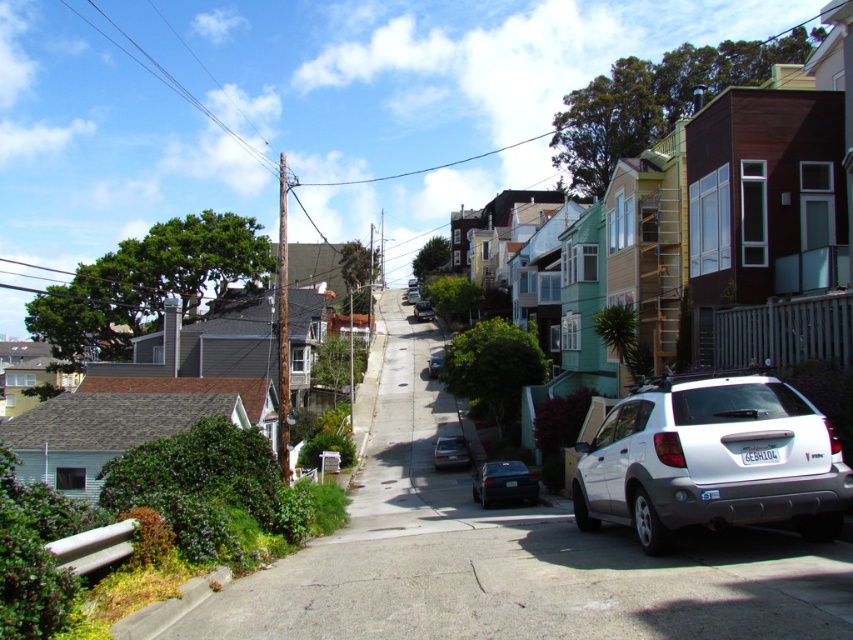
Can you confirm if matte black sedan at center is smaller than metallic silver sedan at center?

No.

Between point (445, 440) and point (438, 355), which one is positioned in front?

Positioned in front is point (445, 440).

Image resolution: width=853 pixels, height=640 pixels. Identify the location of matte black sedan at center. (450, 452).

Does satin black sedan at center appear on the right side of metallic silver sedan at center?

No, satin black sedan at center is not to the right of metallic silver sedan at center.

Based on the photo, which of these two, satin black sedan at center or metallic silver sedan at center, stands taller?

Standing taller between the two is satin black sedan at center.

Identify the location of satin black sedan at center. (422, 310).

The image size is (853, 640). Find the location of `satin black sedan at center`. satin black sedan at center is located at coordinates (422, 310).

This screenshot has width=853, height=640. What do you see at coordinates (711, 460) in the screenshot?
I see `white matte suv at lower right` at bounding box center [711, 460].

Is point (648, 404) behind point (495, 486)?

That is False.

Does point (720, 476) come farther from viewer compared to point (473, 493)?

No.

The image size is (853, 640). I want to click on white matte suv at lower right, so click(x=711, y=460).